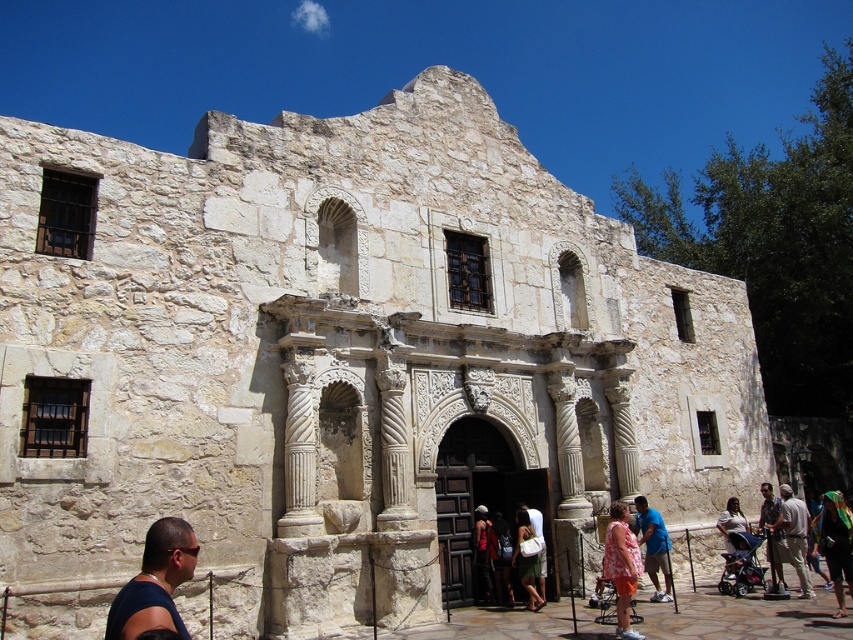
Measure the distance from dark blue t-shirt at lower left to camouflage fabric shirt at lower right.

dark blue t-shirt at lower left is 37.34 meters from camouflage fabric shirt at lower right.

Between point (161, 589) and point (762, 500), which one is positioned behind?

Positioned behind is point (762, 500).

The width and height of the screenshot is (853, 640). Describe the element at coordinates (155, 580) in the screenshot. I see `dark blue t-shirt at lower left` at that location.

The width and height of the screenshot is (853, 640). I want to click on dark blue t-shirt at lower left, so click(x=155, y=580).

Between green fabric headscarf at lower right and camouflage fabric shirt at lower right, which one is positioned lower?

green fabric headscarf at lower right

Can you confirm if green fabric headscarf at lower right is positioned above camouflage fabric shirt at lower right?

No, green fabric headscarf at lower right is not above camouflage fabric shirt at lower right.

Identify the location of green fabric headscarf at lower right. tap(834, 544).

Which is more to the left, green fabric headscarf at lower right or dark blue denim jeans at center?

dark blue denim jeans at center is more to the left.

Between point (842, 513) and point (500, 536), which one is positioned in front?

Point (842, 513) is in front.

Does point (845, 525) come farther from viewer compared to point (509, 536)?

No, it is not.

The image size is (853, 640). Find the location of `green fabric headscarf at lower right`. green fabric headscarf at lower right is located at coordinates (834, 544).